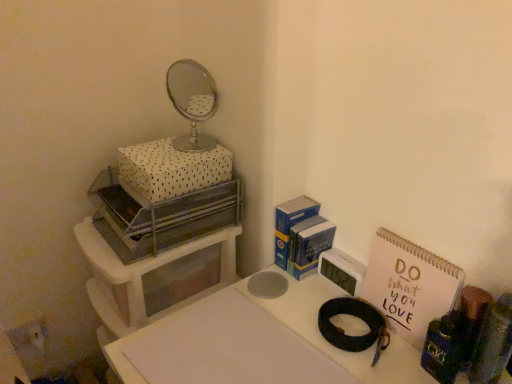
This screenshot has height=384, width=512. I want to click on vacant space situated on the left part of shiny metallic magnifying glass at upper center, so click(x=288, y=307).